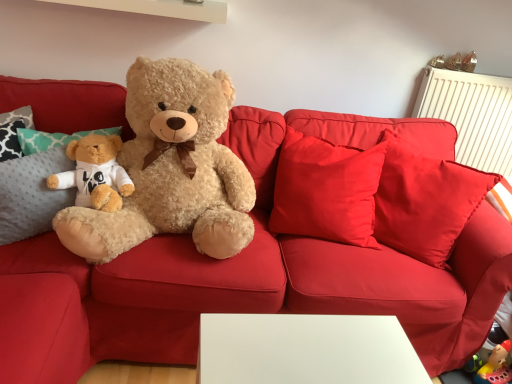
The image size is (512, 384). Identify the location of matte brown teddy bear at upper right, which appears as the first toy when viewed from the left. click(454, 62).

Image resolution: width=512 pixels, height=384 pixels. What do you see at coordinates (469, 62) in the screenshot? I see `metallic gold earrings at upper right, positioned as the second toy in left-to-right order` at bounding box center [469, 62].

At what (x,y) coordinates should I click in order to perform the action: click on fluffy beige teddy bear at left. Please return your answer as a coordinate pair (x, y). Looking at the image, I should click on (170, 169).

Could you tell me if metallic gold earrings at upper right, positioned as the second toy in left-to-right order, is facing fluffy beige teddy bear at left?

No, metallic gold earrings at upper right, positioned as the second toy in left-to-right order, is not turned towards fluffy beige teddy bear at left.

Considering the relative sizes of metallic gold earrings at upper right, positioned as the second toy in left-to-right order, and fluffy beige teddy bear at left in the image provided, is metallic gold earrings at upper right, positioned as the second toy in left-to-right order, thinner than fluffy beige teddy bear at left?

Yes, metallic gold earrings at upper right, positioned as the second toy in left-to-right order, is thinner than fluffy beige teddy bear at left.

Is point (469, 62) closer to camera compared to point (160, 141)?

That is False.

In the image, there is a metallic gold earrings at upper right, positioned as the second toy in left-to-right order. Where is `toy above it (from the image's perspective)`? This screenshot has width=512, height=384. toy above it (from the image's perspective) is located at coordinates tap(454, 62).

Is metallic gold earrings at upper right, positioned as the second toy in left-to-right order, looking in the opposite direction of matte brown teddy bear at upper right, acting as the second toy starting from the right?

That's not correct — metallic gold earrings at upper right, positioned as the second toy in left-to-right order, is not looking away from matte brown teddy bear at upper right, acting as the second toy starting from the right.

Looking at this image, is metallic gold earrings at upper right, positioned as the second toy in left-to-right order, far from matte brown teddy bear at upper right, acting as the second toy starting from the right?

No.

From the image's perspective, which one is positioned higher, metallic gold earrings at upper right, which is the 1th toy from right to left, or matte brown teddy bear at upper right, acting as the second toy starting from the right?

matte brown teddy bear at upper right, acting as the second toy starting from the right.

Which of these two, fluffy beige teddy bear at left or matte brown teddy bear at upper right, acting as the second toy starting from the right, is thinner?

matte brown teddy bear at upper right, acting as the second toy starting from the right.

Is fluffy beige teddy bear at left oriented towards matte brown teddy bear at upper right, which appears as the first toy when viewed from the left?

No, fluffy beige teddy bear at left is not oriented towards matte brown teddy bear at upper right, which appears as the first toy when viewed from the left.

Would you say fluffy beige teddy bear at left is outside matte brown teddy bear at upper right, which appears as the first toy when viewed from the left?

Yes, fluffy beige teddy bear at left is not within matte brown teddy bear at upper right, which appears as the first toy when viewed from the left.

Which is more to the right, matte brown teddy bear at upper right, which appears as the first toy when viewed from the left, or metallic gold earrings at upper right, which is the 1th toy from right to left?

Positioned to the right is metallic gold earrings at upper right, which is the 1th toy from right to left.

Based on the photo, who is smaller, matte brown teddy bear at upper right, acting as the second toy starting from the right, or metallic gold earrings at upper right, which is the 1th toy from right to left?

With smaller size is matte brown teddy bear at upper right, acting as the second toy starting from the right.

Does matte brown teddy bear at upper right, which appears as the first toy when viewed from the left, come in front of metallic gold earrings at upper right, which is the 1th toy from right to left?

Yes, the depth of matte brown teddy bear at upper right, which appears as the first toy when viewed from the left, is less than that of metallic gold earrings at upper right, which is the 1th toy from right to left.

Is fluffy beige teddy bear at left completely or partially inside matte brown teddy bear at upper right, which appears as the first toy when viewed from the left?

Definitely not — fluffy beige teddy bear at left is not inside matte brown teddy bear at upper right, which appears as the first toy when viewed from the left.

Is matte brown teddy bear at upper right, acting as the second toy starting from the right, thinner than fluffy beige teddy bear at left?

Correct, the width of matte brown teddy bear at upper right, acting as the second toy starting from the right, is less than that of fluffy beige teddy bear at left.

From the image's perspective, between matte brown teddy bear at upper right, which appears as the first toy when viewed from the left, and fluffy beige teddy bear at left, which one is located above?

matte brown teddy bear at upper right, which appears as the first toy when viewed from the left, from the image's perspective.

Does matte brown teddy bear at upper right, acting as the second toy starting from the right, appear on the right side of fluffy beige teddy bear at left?

Correct, you'll find matte brown teddy bear at upper right, acting as the second toy starting from the right, to the right of fluffy beige teddy bear at left.

Is fluffy beige teddy bear at left bigger or smaller than metallic gold earrings at upper right, which is the 1th toy from right to left?

fluffy beige teddy bear at left is bigger than metallic gold earrings at upper right, which is the 1th toy from right to left.

Based on the photo, is the depth of fluffy beige teddy bear at left greater than that of metallic gold earrings at upper right, which is the 1th toy from right to left?

No, fluffy beige teddy bear at left is closer to the camera.

In terms of height, does fluffy beige teddy bear at left look taller or shorter compared to metallic gold earrings at upper right, which is the 1th toy from right to left?

In the image, fluffy beige teddy bear at left appears to be taller than metallic gold earrings at upper right, which is the 1th toy from right to left.

Where is `the 1st toy above the fluffy beige teddy bear at left (from the image's perspective)`? This screenshot has height=384, width=512. the 1st toy above the fluffy beige teddy bear at left (from the image's perspective) is located at coordinates (469, 62).

Where is `the 2nd toy directly above the fluffy beige teddy bear at left (from a real-world perspective)`? the 2nd toy directly above the fluffy beige teddy bear at left (from a real-world perspective) is located at coordinates (469, 62).

The height and width of the screenshot is (384, 512). What are the coordinates of `toy that is under the metallic gold earrings at upper right, positioned as the second toy in left-to-right order (from a real-world perspective)` in the screenshot? It's located at (454, 62).

From the image, which object appears to be farther from fluffy beige teddy bear at left, matte brown teddy bear at upper right, acting as the second toy starting from the right, or metallic gold earrings at upper right, positioned as the second toy in left-to-right order?

metallic gold earrings at upper right, positioned as the second toy in left-to-right order.

When comparing their distances from metallic gold earrings at upper right, positioned as the second toy in left-to-right order, does matte brown teddy bear at upper right, which appears as the first toy when viewed from the left, or fluffy beige teddy bear at left seem closer?

The object closer to metallic gold earrings at upper right, positioned as the second toy in left-to-right order, is matte brown teddy bear at upper right, which appears as the first toy when viewed from the left.

Consider the image. Which object lies nearer to the anchor point metallic gold earrings at upper right, positioned as the second toy in left-to-right order, fluffy beige teddy bear at left or matte brown teddy bear at upper right, which appears as the first toy when viewed from the left?

Among the two, matte brown teddy bear at upper right, which appears as the first toy when viewed from the left, is located nearer to metallic gold earrings at upper right, positioned as the second toy in left-to-right order.

Which object lies further to the anchor point matte brown teddy bear at upper right, which appears as the first toy when viewed from the left, fluffy beige teddy bear at left or metallic gold earrings at upper right, which is the 1th toy from right to left?

The object further to matte brown teddy bear at upper right, which appears as the first toy when viewed from the left, is fluffy beige teddy bear at left.

Consider the image. Considering their positions, is metallic gold earrings at upper right, which is the 1th toy from right to left, positioned closer to fluffy beige teddy bear at left than matte brown teddy bear at upper right, which appears as the first toy when viewed from the left?

matte brown teddy bear at upper right, which appears as the first toy when viewed from the left, is positioned closer to the anchor fluffy beige teddy bear at left.

Based on their spatial positions, is metallic gold earrings at upper right, positioned as the second toy in left-to-right order, or fluffy beige teddy bear at left further from matte brown teddy bear at upper right, which appears as the first toy when viewed from the left?

The object further to matte brown teddy bear at upper right, which appears as the first toy when viewed from the left, is fluffy beige teddy bear at left.

Locate an element on the screen. This screenshot has height=384, width=512. toy between fluffy beige teddy bear at left and metallic gold earrings at upper right, positioned as the second toy in left-to-right order, in the horizontal direction is located at coordinates (454, 62).